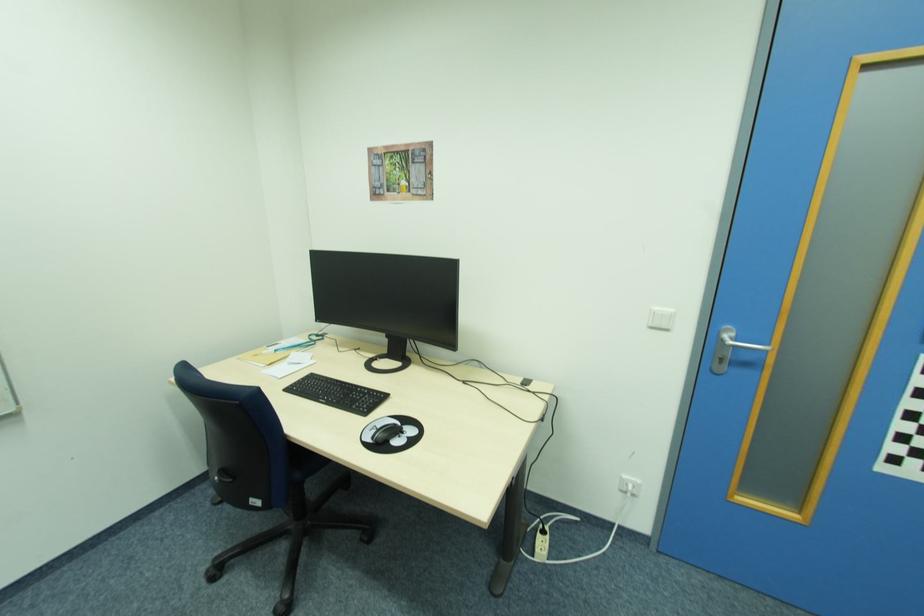
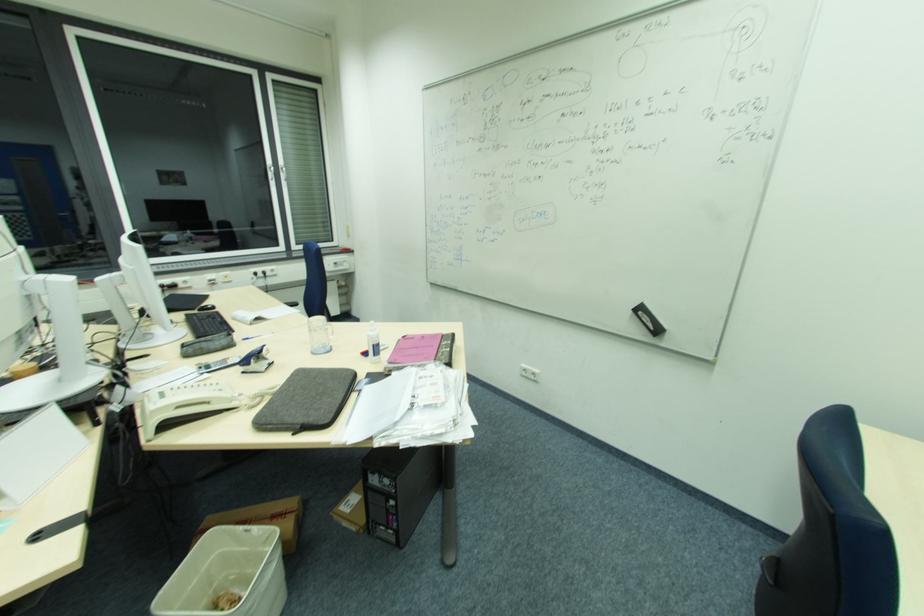
The first image is from the beginning of the video and the second image is from the end. How did the camera likely rotate when shooting the video?

The camera rotated toward left-down.